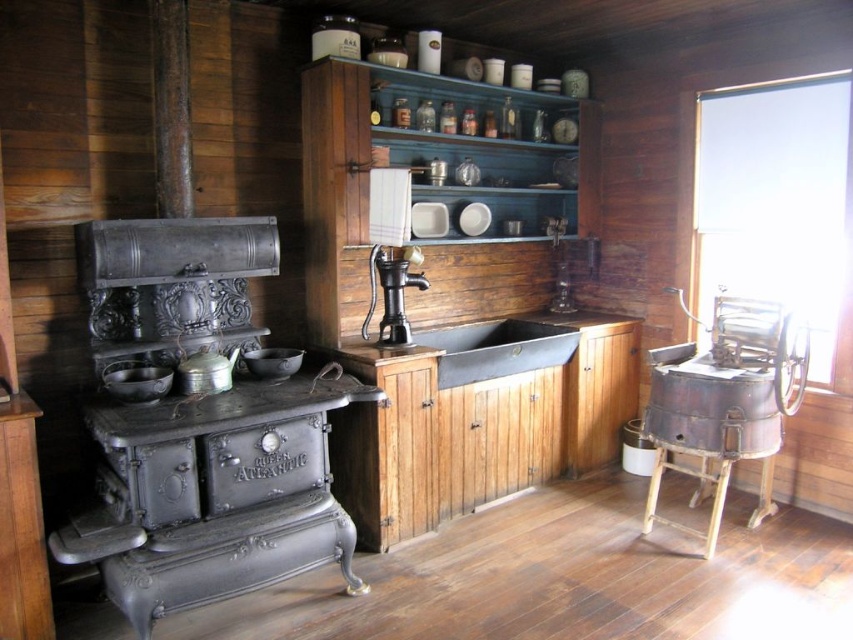
Who is positioned more to the left, black cast iron sink at center or shiny metallic bowl at center?

A: From the viewer's perspective, shiny metallic bowl at center appears more on the left side.

Can you confirm if black cast iron sink at center is positioned to the right of shiny metallic bowl at center?

Correct, you'll find black cast iron sink at center to the right of shiny metallic bowl at center.

Image resolution: width=853 pixels, height=640 pixels. In order to click on black cast iron sink at center in this screenshot , I will do `click(496, 348)`.

At what (x,y) coordinates should I click in order to perform the action: click on black cast iron sink at center. Please return your answer as a coordinate pair (x, y). Looking at the image, I should click on (496, 348).

Can you confirm if polished brass faucet at center is wider than matte black pot at left?

Yes, polished brass faucet at center is wider than matte black pot at left.

Which is more to the left, polished brass faucet at center or matte black pot at left?

Positioned to the left is matte black pot at left.

Measure the distance between point (419, 278) and camera.

The distance of point (419, 278) from camera is 11.28 feet.

This screenshot has width=853, height=640. I want to click on polished brass faucet at center, so click(390, 296).

Does polished brass faucet at center have a greater height compared to shiny metallic bowl at center?

Indeed, polished brass faucet at center has a greater height compared to shiny metallic bowl at center.

Who is more distant from viewer, [361,326] or [251,349]?

Positioned behind is point [361,326].

What are the coordinates of `polished brass faucet at center` in the screenshot? It's located at (390, 296).